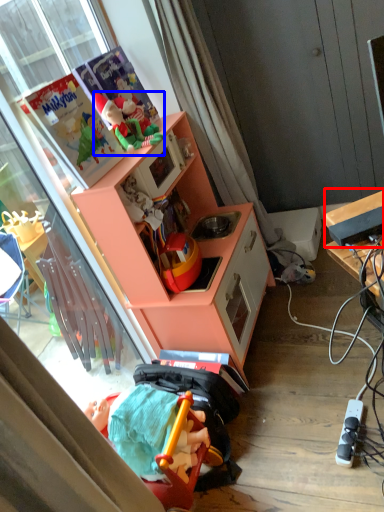
Question: Which object appears closest to the camera in this image, appliance (highlighted by a red box) or toy (highlighted by a blue box)?

Choices:
 (A) appliance
 (B) toy

Answer: (A)